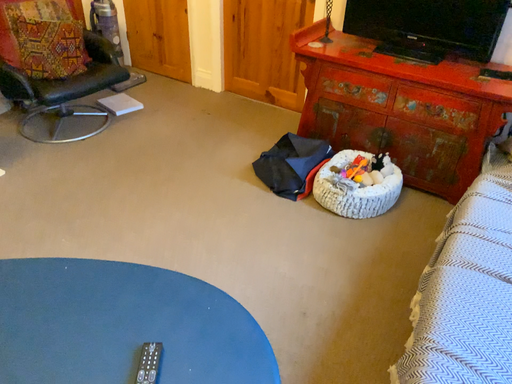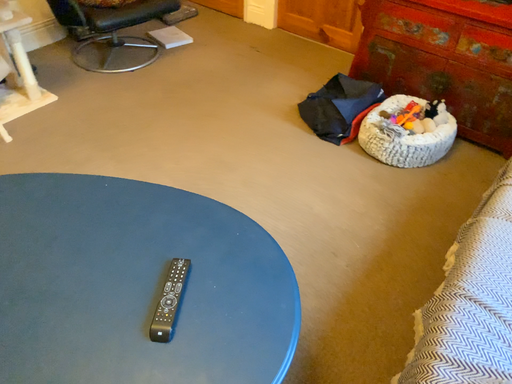
Question: Which way did the camera rotate in the video?

Choices:
 (A) rotated upward
 (B) rotated downward

Answer: (B)